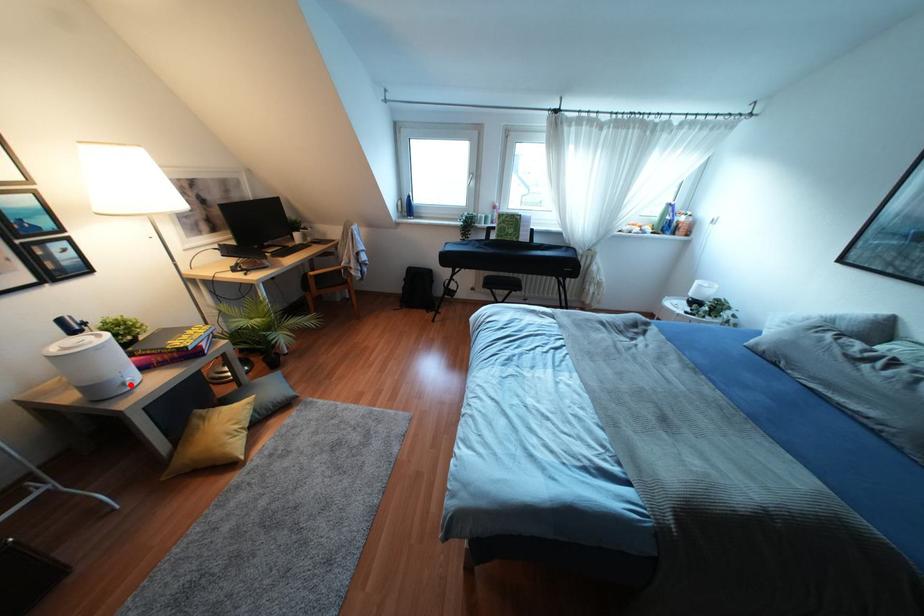
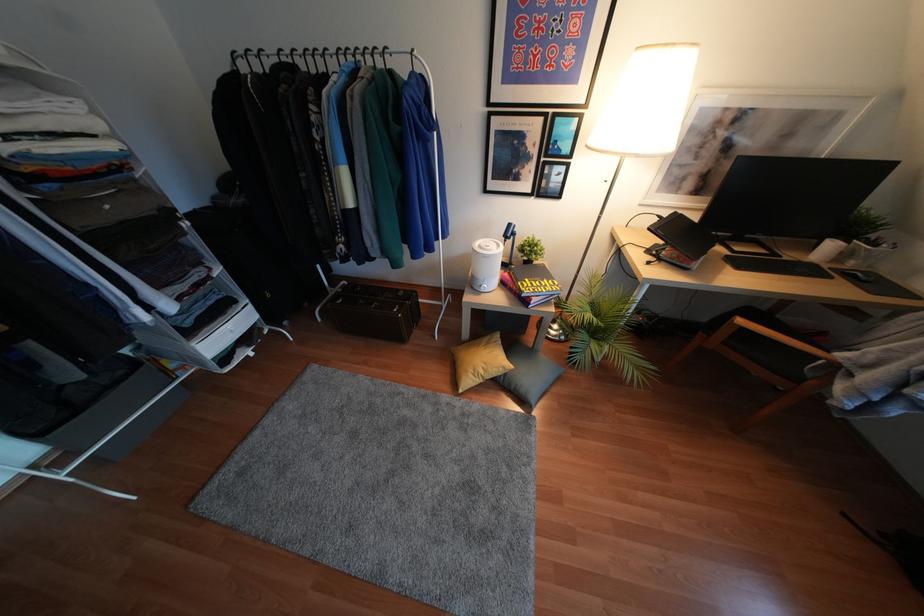
Question: I am providing you with two images of the same scene from different viewpoints. A red point is shown in image1. For the corresponding object point in image2, is it positioned nearer or farther from the camera?

Choices:
 (A) Nearer
 (B) Farther

Answer: (A)